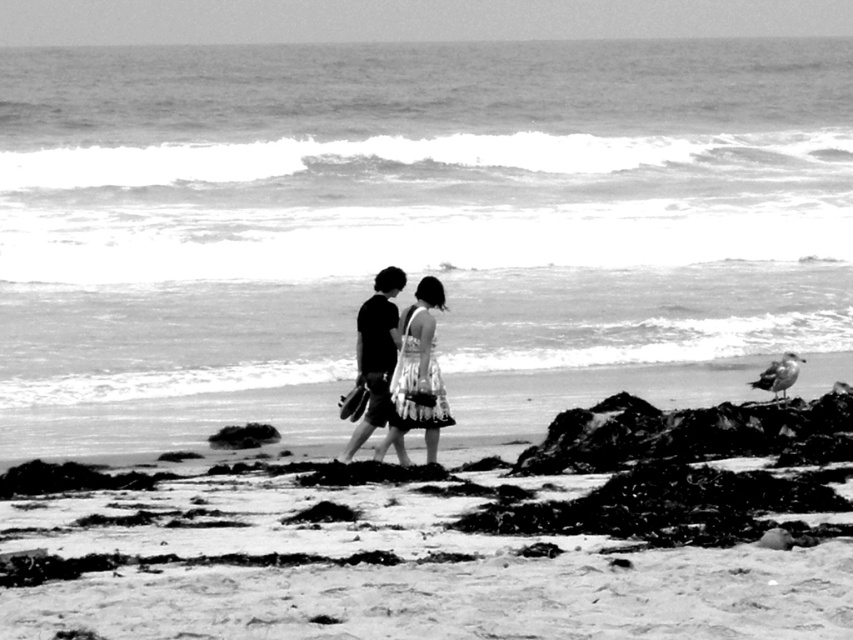
You are a photographer trying to capture the floral dress at center and the smooth sand at center in a single shot. Based on their positions, which object is closer to the camera?

The floral dress at center is closer to the camera because the smooth sand at center is positioned under it, indicating that the dress is in front.

You are a photographer trying to capture the two figures in the scene. Since the floral dress at center and the dark gray fabric shorts at center are both in the frame, which one would you focus on to ensure the smaller object is in sharp focus?

The floral dress at center has a smaller size compared to the dark gray fabric shorts at center, so you should focus on the floral dress at center to ensure the smaller object is in sharp focus.